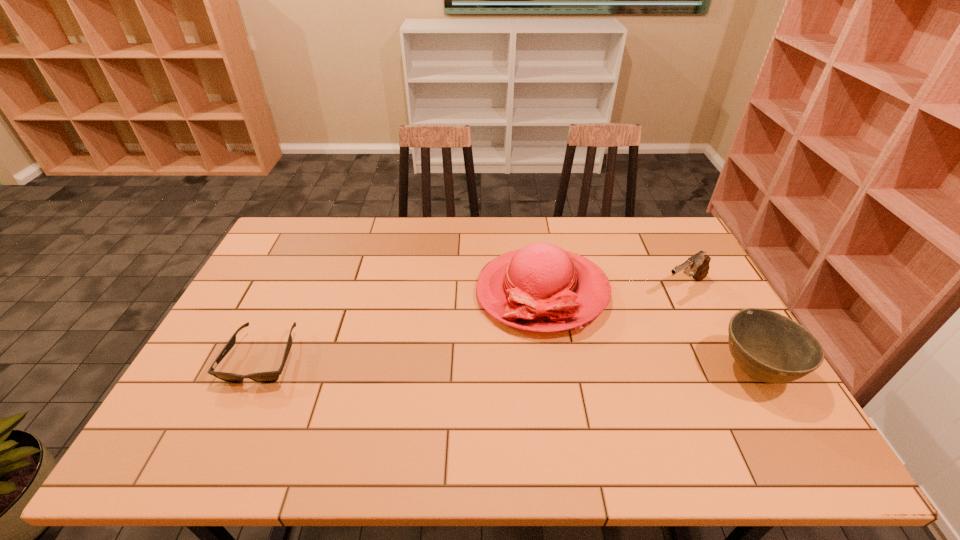
At what (x,y) coordinates should I click in order to perform the action: click on free space on the desktop that is between the leftmost object and the bowl and is positioned at the barrel of the pistol. Please return your answer as a coordinate pair (x, y). Image resolution: width=960 pixels, height=540 pixels. Looking at the image, I should click on (558, 366).

The image size is (960, 540). What are the coordinates of `vacant spot on the desktop that is between the shortest object and the bowl and is positioned at the front of the second object from left to right with a bow` in the screenshot? It's located at (437, 362).